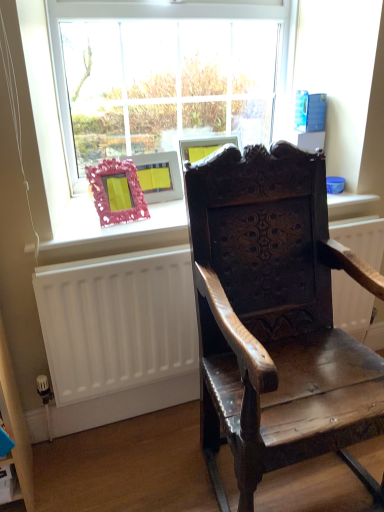
You are a GUI agent. You are given a task and a screenshot of the screen. Output one action in this format:
    pyautogui.click(x=<x>, y=<y>)
    Task: Click on the white matte radiator at lower left
    
    Given the screenshot: What is the action you would take?
    pyautogui.click(x=117, y=321)

The height and width of the screenshot is (512, 384). I want to click on white matte radiator at lower left, so click(117, 321).

In the image, there is a dark wood carved chair at center. In order to click on radiator below it (from a real-world perspective) in this screenshot , I will do `click(117, 321)`.

Which object is closer to the camera taking this photo, white matte radiator at lower left or dark wood carved chair at center?

Positioned in front is dark wood carved chair at center.

Is dark wood carved chair at center a part of white matte radiator at lower left?

A: Actually, dark wood carved chair at center is outside white matte radiator at lower left.

Is white matte radiator at lower left at the left side of dark wood carved chair at center?

Yes, white matte radiator at lower left is to the left of dark wood carved chair at center.

Considering the sizes of objects wooden frame at upper center and pink textured frame at window in the image provided, who is shorter, wooden frame at upper center or pink textured frame at window?

With less height is wooden frame at upper center.

From a real-world perspective, who is located lower, wooden frame at upper center or pink textured frame at window?

wooden frame at upper center.

I want to click on picture frame that is above the wooden frame at upper center (from the image's perspective), so click(x=116, y=192).

Which of these two, wooden frame at upper center or clear glass window at upper center, is smaller?

wooden frame at upper center is smaller.

Visually, is wooden frame at upper center positioned to the left or to the right of clear glass window at upper center?

Based on their positions, wooden frame at upper center is located to the right of clear glass window at upper center.

Where is `window sill in front of the clear glass window at upper center`? The width and height of the screenshot is (384, 512). window sill in front of the clear glass window at upper center is located at coordinates (113, 232).

In the scene shown: Would you say dark wood carved chair at center is outside pink textured frame at window?

Yes.

Is dark wood carved chair at center oriented towards pink textured frame at window?

No, dark wood carved chair at center is not aimed at pink textured frame at window.

Can you tell me how much dark wood carved chair at center and pink textured frame at window differ in facing direction?

6.21 degrees separate the facing orientations of dark wood carved chair at center and pink textured frame at window.

Does dark wood carved chair at center have a greater width compared to pink textured frame at window?

Yes, dark wood carved chair at center is wider than pink textured frame at window.

Is pink textured frame at window smaller than dark wood carved chair at center?

Indeed, pink textured frame at window has a smaller size compared to dark wood carved chair at center.

Identify the location of chair that is below the pink textured frame at window (from the image's perspective). The width and height of the screenshot is (384, 512). pyautogui.click(x=275, y=317).

Would you consider pink textured frame at window to be distant from dark wood carved chair at center?

That's not correct — pink textured frame at window is a little close to dark wood carved chair at center.

Measure the distance between pink textured frame at window and dark wood carved chair at center.

pink textured frame at window is 22.15 inches from dark wood carved chair at center.

What's the angular difference between clear glass window at upper center and wooden frame at upper center's facing directions?

clear glass window at upper center and wooden frame at upper center are facing 1.15 degrees away from each other.

Is clear glass window at upper center in front of wooden frame at upper center?

No, clear glass window at upper center is further to the viewer.

From the image's perspective, is clear glass window at upper center located above or below wooden frame at upper center?

Based on their image positions, clear glass window at upper center is located above wooden frame at upper center.

From their relative heights in the image, would you say dark wood carved chair at center is taller or shorter than wooden frame at upper center?

In the image, dark wood carved chair at center appears to be taller than wooden frame at upper center.

At what (x,y) coordinates should I click in order to perform the action: click on window sill behind the dark wood carved chair at center. Please return your answer as a coordinate pair (x, y). The image size is (384, 512). Looking at the image, I should click on (113, 232).

Is wooden frame at upper center inside dark wood carved chair at center?

No, wooden frame at upper center is located outside of dark wood carved chair at center.

Locate an element on the screen. This screenshot has width=384, height=512. chair in front of the white matte radiator at lower left is located at coordinates tap(275, 317).

I want to click on window sill on the right of pink textured frame at window, so [x=113, y=232].

When comparing their distances from wooden frame at upper center, does clear glass window at upper center or pink textured frame at window seem closer?

pink textured frame at window is positioned closer to the anchor wooden frame at upper center.

Which object lies nearer to the anchor point white matte radiator at lower left, pink textured frame at window or clear glass window at upper center?

pink textured frame at window.

Considering their positions, is dark wood carved chair at center positioned further to clear glass window at upper center than white matte radiator at lower left?

dark wood carved chair at center lies further to clear glass window at upper center than the other object.

Which object lies further to the anchor point pink textured frame at window, wooden frame at upper center or dark wood carved chair at center?

dark wood carved chair at center is further to pink textured frame at window.

From the picture: From the image, which object appears to be nearer to dark wood carved chair at center, wooden frame at upper center or white matte radiator at lower left?

white matte radiator at lower left is positioned closer to the anchor dark wood carved chair at center.

When comparing their distances from clear glass window at upper center, does wooden frame at upper center or dark wood carved chair at center seem closer?

wooden frame at upper center lies closer to clear glass window at upper center than the other object.

Which object lies further to the anchor point wooden frame at upper center, clear glass window at upper center or dark wood carved chair at center?

Based on the image, clear glass window at upper center appears to be further to wooden frame at upper center.

Considering their positions, is white matte radiator at lower left positioned closer to wooden frame at upper center than clear glass window at upper center?

The object closer to wooden frame at upper center is white matte radiator at lower left.

Identify the location of radiator located between dark wood carved chair at center and wooden frame at upper center in the depth direction. (117, 321).

Locate an element on the screen. This screenshot has height=512, width=384. picture frame between clear glass window at upper center and dark wood carved chair at center from top to bottom is located at coordinates (116, 192).

This screenshot has height=512, width=384. I want to click on window sill between pink textured frame at window and white matte radiator at lower left from top to bottom, so click(113, 232).

I want to click on window sill between dark wood carved chair at center and pink textured frame at window along the z-axis, so click(113, 232).